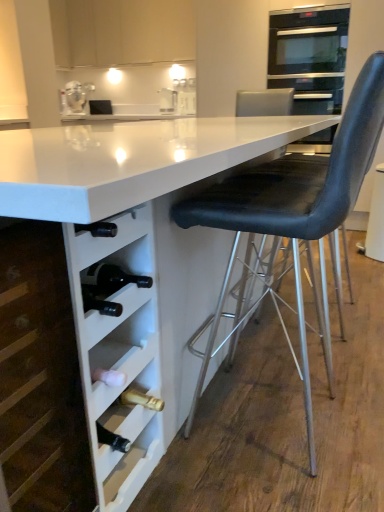
Question: From the image's perspective, relative to black leather chair at right, is stainless steel oven at upper right above or below?

Choices:
 (A) below
 (B) above

Answer: (B)

Question: In the image, is stainless steel oven at upper right positioned in front of or behind black leather chair at right?

Choices:
 (A) front
 (B) behind

Answer: (B)

Question: Estimate the real-world distances between objects in this image. Which object is closer to the white matte wine rack at lower left, which is the 2th cabinetry from back to front?

Choices:
 (A) black leather chair at right
 (B) clear glass jar at upper left
 (C) stainless steel oven at upper right
 (D) black leather swivel chair at right
 (E) white glossy table at center

Answer: (E)

Question: Which of these objects is positioned closest to the white glossy table at center?

Choices:
 (A) stainless steel oven at upper right
 (B) clear glass jar at upper left
 (C) black leather swivel chair at right
 (D) black leather chair at right
 (E) white matte cabinet at upper center, the 1th cabinetry viewed from the top

Answer: (D)